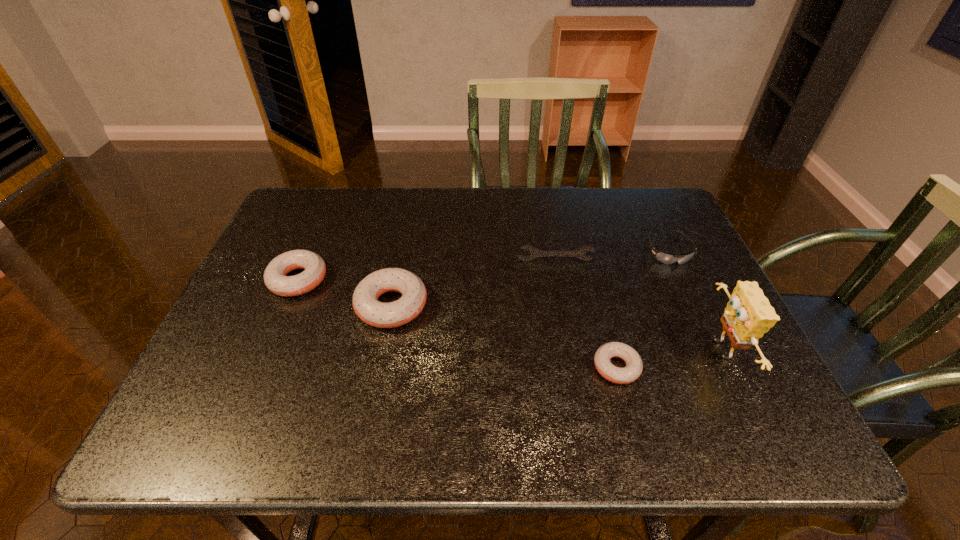
Identify which doughnut is the second nearest to the second object from left to right. Please provide its 2D coordinates. Your answer should be formatted as a tuple, i.e. [(x, y)], where the tuple contains the x and y coordinates of a point satisfying the conditions above.

[(634, 366)]

I want to click on doughnut that is the second closest to the rightmost doughnut, so click(275, 278).

You are a GUI agent. You are given a task and a screenshot of the screen. Output one action in this format:
    pyautogui.click(x=<x>, y=<y>)
    Task: Click on the free location that satisfies the following two spatial constraints: 1. on the front side of the second object from left to right; 2. on the left side of the leftmost object
    The height and width of the screenshot is (540, 960).
    Given the screenshot: What is the action you would take?
    pyautogui.click(x=287, y=305)